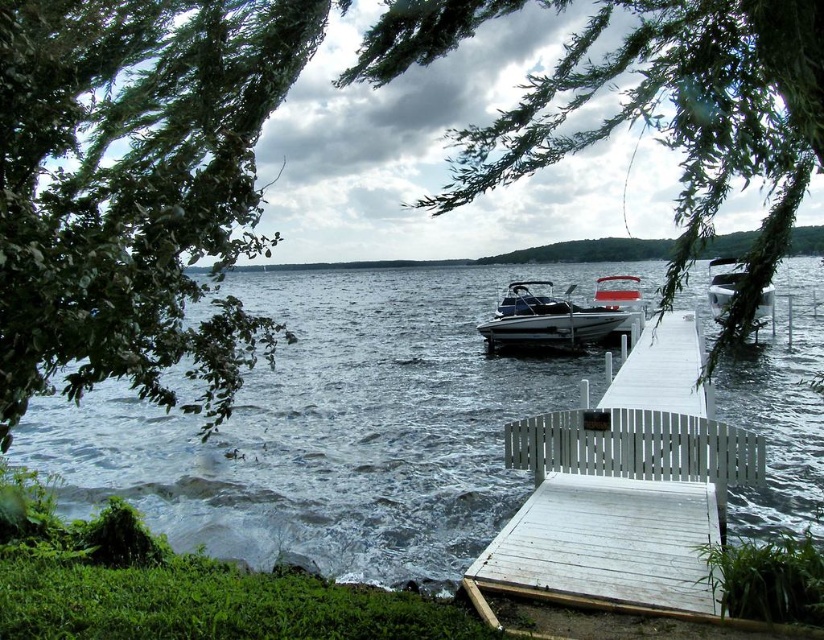
Question: Which of these objects is positioned farthest from the metallic blue boat at center?

Choices:
 (A) green leafy tree at center
 (B) dark blue water at center
 (C) white plastic boat at center-right

Answer: (A)

Question: Based on their relative distances, which object is farther from the green leafy tree at center?

Choices:
 (A) green leafy branches at upper left
 (B) white wooden dock at center
 (C) white plastic boat at center-right
 (D) dark blue water at center

Answer: (D)

Question: Is white wooden dock at center closer to camera compared to metallic blue boat at center?

Choices:
 (A) no
 (B) yes

Answer: (B)

Question: Which of these objects is positioned farthest from the dark blue water at center?

Choices:
 (A) metallic blue boat at center
 (B) green leafy tree at center

Answer: (A)

Question: Does green leafy branches at upper left have a smaller size compared to metallic blue boat at center?

Choices:
 (A) yes
 (B) no

Answer: (B)

Question: Is the position of dark blue water at center less distant than that of green leafy branches at upper left?

Choices:
 (A) no
 (B) yes

Answer: (A)